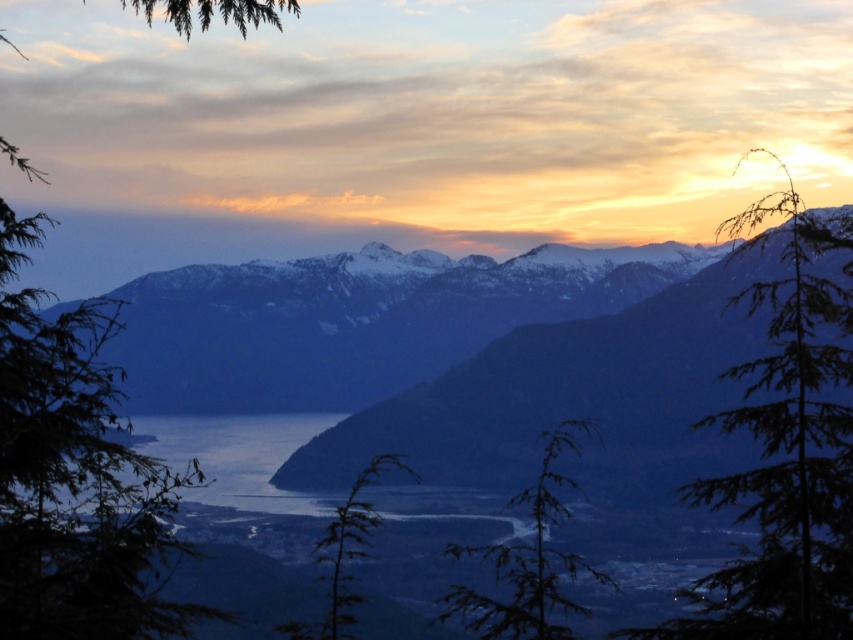
Question: Based on their relative distances, which object is nearer to the green matte tree at left?

Choices:
 (A) green matte tree at center
 (B) snowy mountain range at center

Answer: (A)

Question: Estimate the real-world distances between objects in this image. Which object is closer to the green fuzzy plant at center?

Choices:
 (A) snowy mountain range at center
 (B) green matte tree at center
 (C) green matte tree at left

Answer: (B)

Question: Is green matte tree at left below green fuzzy plant at center?

Choices:
 (A) yes
 (B) no

Answer: (B)

Question: Can you confirm if green needle-like tree at upper right is bigger than green fuzzy plant at center?

Choices:
 (A) yes
 (B) no

Answer: (A)

Question: Is green matte tree at left to the right of green matte tree at center from the viewer's perspective?

Choices:
 (A) yes
 (B) no

Answer: (B)

Question: Which is nearer to the snowy mountain range at center?

Choices:
 (A) green matte tree at left
 (B) green needle-like tree at upper right

Answer: (A)